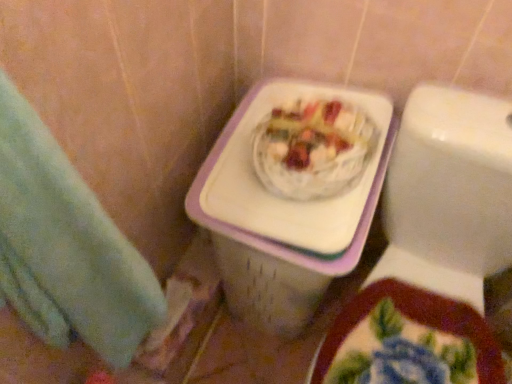
Identify the location of white glossy toilet at upper right. The image size is (512, 384). (433, 251).

What is the approximate width of green towel at left?

green towel at left is 7.38 inches wide.

At what (x,y) coordinates should I click in order to perform the action: click on white glossy toilet at upper right. Please return your answer as a coordinate pair (x, y). The height and width of the screenshot is (384, 512). Looking at the image, I should click on (433, 251).

Which point is more forward, (236, 234) or (386, 207)?

The point (236, 234) is closer to the camera.

Is white plastic basket at center next to white glossy toilet at upper right?

No, white plastic basket at center is not next to white glossy toilet at upper right.

Can white glossy toilet at upper right be found inside white plastic basket at center?

No, white glossy toilet at upper right is not surrounded by white plastic basket at center.

Is white plastic basket at center facing towards white glossy toilet at upper right?

No, white plastic basket at center is not aimed at white glossy toilet at upper right.

Which is closer, [410,342] or [152,299]?

Point [410,342] is positioned farther from the camera compared to point [152,299].

Is white glossy toilet at upper right to the left or to the right of green towel at left in the image?

Based on their positions, white glossy toilet at upper right is located to the right of green towel at left.

You are a GUI agent. You are given a task and a screenshot of the screen. Output one action in this format:
    pyautogui.click(x=<x>, y=<y>)
    Task: Click on the hand towel lying above the white glossy toilet at upper right (from the image's perspective)
    This screenshot has height=384, width=512.
    Given the screenshot: What is the action you would take?
    pyautogui.click(x=66, y=247)

In the scene shown: Does white glossy toilet at upper right have a smaller size compared to green towel at left?

No, white glossy toilet at upper right is not smaller than green towel at left.

Which point is more distant from viewer, (x=67, y=342) or (x=389, y=238)?

The point (x=389, y=238) is farther from the camera.

Considering the relative sizes of green towel at left and white glossy toilet at upper right in the image provided, is green towel at left shorter than white glossy toilet at upper right?

Yes.

Between green towel at left and white glossy toilet at upper right, which one has smaller width?

Thinner between the two is green towel at left.

Between green towel at left and white glossy toilet at upper right, which one appears on the left side from the viewer's perspective?

green towel at left is more to the left.

From the image's perspective, is white glossy toilet at upper right above or below white plastic basket at center?

white glossy toilet at upper right is situated lower than white plastic basket at center in the image.

Is white glossy toilet at upper right positioned in front of white plastic basket at center?

Yes, it is.

Based on the photo, from the image's perspective, is green towel at left under white plastic basket at center?

Yes.

Could you tell me if green towel at left is turned towards white plastic basket at center?

No, green towel at left is not oriented towards white plastic basket at center.

Is green towel at left not inside white plastic basket at center?

Yes, green towel at left is located beyond the bounds of white plastic basket at center.

Consider the image. In terms of size, does green towel at left appear bigger or smaller than white plastic basket at center?

Considering their sizes, green towel at left takes up less space than white plastic basket at center.

Which object is positioned more to the right, white plastic basket at center or green towel at left?

Positioned to the right is white plastic basket at center.

Considering the sizes of objects white plastic basket at center and green towel at left in the image provided, who is thinner, white plastic basket at center or green towel at left?

With smaller width is green towel at left.

Is green towel at left a part of white plastic basket at center?

No, green towel at left is not surrounded by white plastic basket at center.

Is white plastic basket at center oriented towards green towel at left?

Yes, white plastic basket at center is oriented towards green towel at left.

At what (x,y) coordinates should I click in order to perform the action: click on porcelain that appears below the white glossy toilet at upper right (from a real-world perspective). Please return your answer as a coordinate pair (x, y). The image size is (512, 384). Looking at the image, I should click on (292, 195).

You are a GUI agent. You are given a task and a screenshot of the screen. Output one action in this format:
    pyautogui.click(x=<x>, y=<y>)
    Task: Click on the hand towel above the white glossy toilet at upper right (from a real-world perspective)
    This screenshot has height=384, width=512.
    Given the screenshot: What is the action you would take?
    pyautogui.click(x=66, y=247)

From the image, which object appears to be nearer to white glossy toilet at upper right, white plastic basket at center or green towel at left?

white plastic basket at center is positioned closer to the anchor white glossy toilet at upper right.

Estimate the real-world distances between objects in this image. Which object is further from white glossy toilet at upper right, green towel at left or white plastic basket at center?

green towel at left.

Looking at the image, which one is located closer to green towel at left, white glossy toilet at upper right or white plastic basket at center?

Based on the image, white plastic basket at center appears to be nearer to green towel at left.

Considering their positions, is green towel at left positioned closer to white plastic basket at center than white glossy toilet at upper right?

The object closer to white plastic basket at center is white glossy toilet at upper right.

Considering their positions, is white plastic basket at center positioned closer to green towel at left than white glossy toilet at upper right?

white plastic basket at center is positioned closer to the anchor green towel at left.

Based on their spatial positions, is white glossy toilet at upper right or green towel at left further from white plastic basket at center?

green towel at left is further to white plastic basket at center.

This screenshot has width=512, height=384. Find the location of `porcelain between green towel at left and white glossy toilet at upper right in the horizontal direction`. porcelain between green towel at left and white glossy toilet at upper right in the horizontal direction is located at coordinates (292, 195).